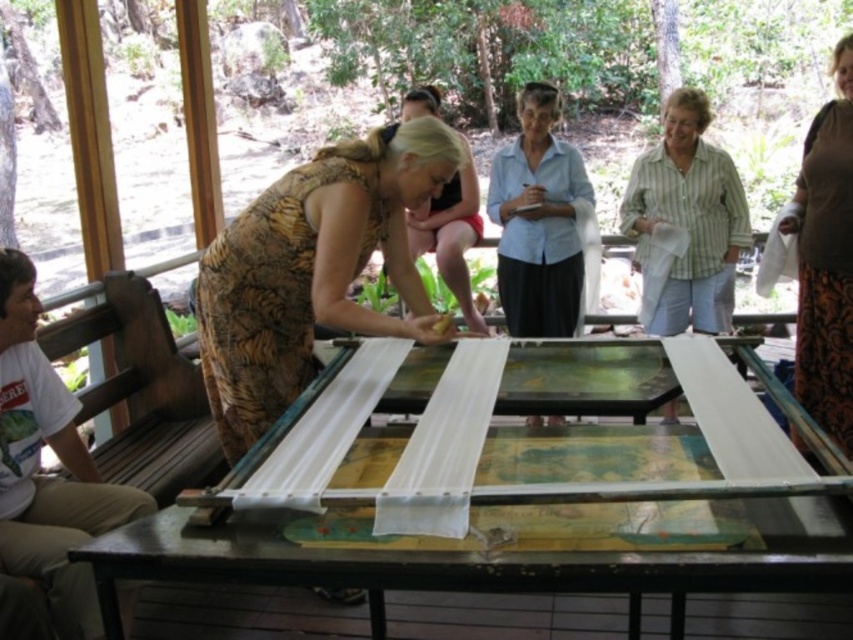
You are standing in front of the table and want to place a small object on the table. You have two points to choose from, point A at point (798, 273) and point B at point (529, 154). Which point is closer to you?

Point A at point (798, 273) is closer to the viewer than point B at point (529, 154).

You are standing at the point labeled point (x=816, y=289) and want to reach the point labeled point (x=206, y=566). Which direction should you move to get there?

You should move forward because point (x=206, y=566) is in front of point (x=816, y=289).

You are a person standing next to the metallic silver table at center and the brown textured skirt at right. Which object is shorter?

The metallic silver table at center is shorter than the brown textured skirt at right.